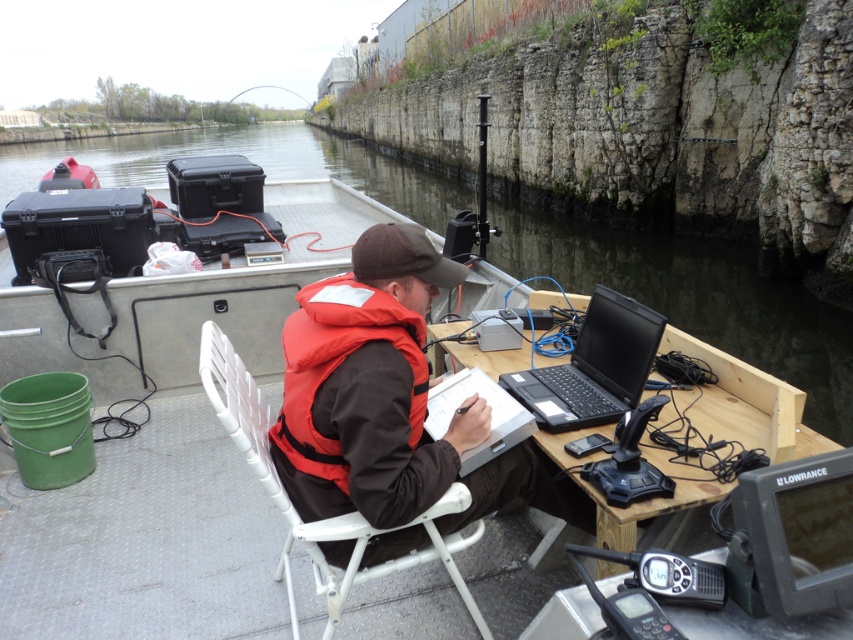
Question: Where is white plastic chair at center located in relation to red matte life jacket at center in the image?

Choices:
 (A) right
 (B) left

Answer: (B)

Question: Which point is farther to the camera?

Choices:
 (A) black matte laptop at center
 (B) orange life vest at center
 (C) wooden table at center

Answer: (A)

Question: Based on their relative distances, which object is nearer to the white plastic chair at center?

Choices:
 (A) clear water at boat center
 (B) red matte life jacket at center

Answer: (B)

Question: Is clear water at boat center thinner than orange life vest at center?

Choices:
 (A) yes
 (B) no

Answer: (B)

Question: Which point is closer to the camera taking this photo?

Choices:
 (A) (575, 403)
 (B) (349, 584)

Answer: (B)

Question: Does wooden table at center have a lesser width compared to black matte laptop at center?

Choices:
 (A) no
 (B) yes

Answer: (A)